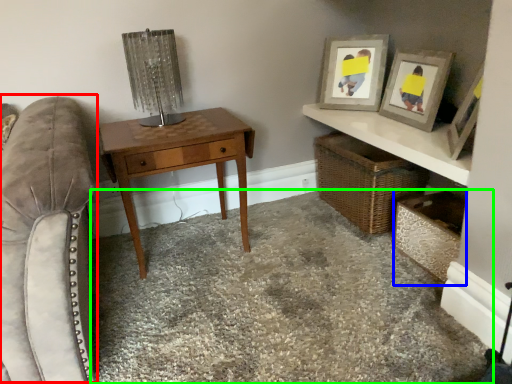
Question: Considering the real-world distances, which object is closest to swivel chair (highlighted by a red box)? shelf (highlighted by a blue box) or concrete (highlighted by a green box).

Choices:
 (A) shelf
 (B) concrete

Answer: (B)